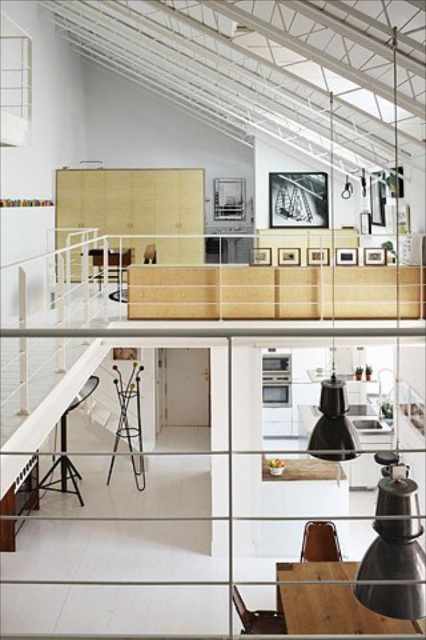
Question: Which of the following is the closest to the observer?

Choices:
 (A) matte black lampshade at right
 (B) metallic wire chair at center

Answer: (A)

Question: Can you confirm if matte black lampshade at right is positioned to the right of wooden chair at center?

Choices:
 (A) no
 (B) yes

Answer: (B)

Question: Among these objects, which one is farthest from the camera?

Choices:
 (A) black matte pendant light at center
 (B) brown wooden chair at lower right

Answer: (B)

Question: Where is matte black lampshade at right located in relation to brown wooden chair at lower right in the image?

Choices:
 (A) below
 (B) above

Answer: (B)

Question: Can you confirm if metallic wire chair at center is thinner than brown wooden chair at lower right?

Choices:
 (A) yes
 (B) no

Answer: (B)

Question: Which object is farther from the camera taking this photo?

Choices:
 (A) metallic stool at lower left
 (B) matte black lampshade at right
 (C) brown wooden chair at lower right
 (D) wooden chair at center

Answer: (D)